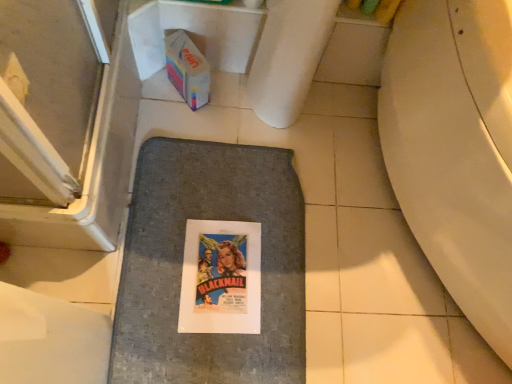
Where is `unoccupied region to the right of gray fabric bath mat at center`? This screenshot has width=512, height=384. unoccupied region to the right of gray fabric bath mat at center is located at coordinates (370, 293).